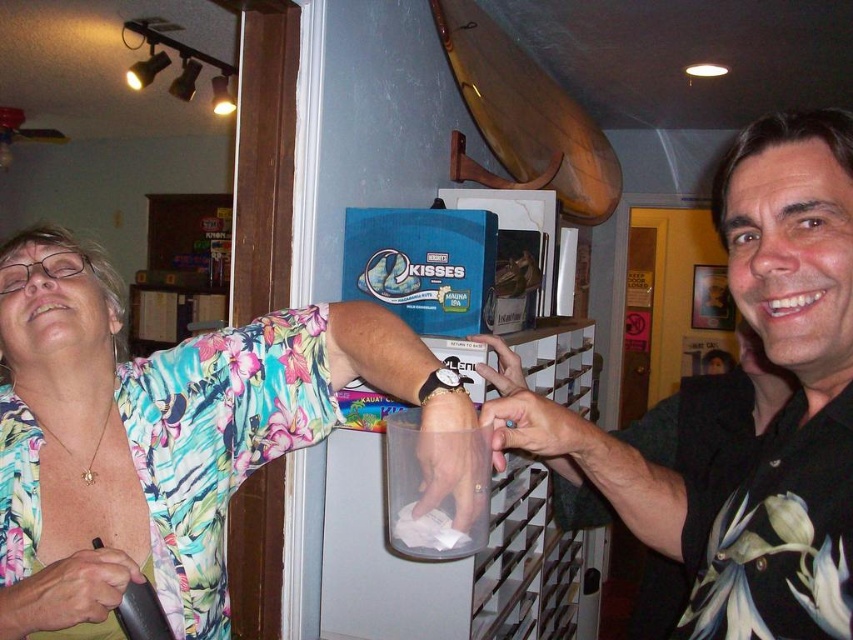
Question: Can you confirm if floral fabric shirt at upper left is positioned to the right of black matte shirt at center?

Choices:
 (A) yes
 (B) no

Answer: (B)

Question: Is the position of floral fabric shirt at upper left less distant than that of black matte shirt at center?

Choices:
 (A) yes
 (B) no

Answer: (B)

Question: Which of the following is the closest to the observer?

Choices:
 (A) black matte shirt at center
 (B) floral fabric shirt at upper left

Answer: (A)

Question: Is floral fabric shirt at upper left to the left of black matte shirt at center from the viewer's perspective?

Choices:
 (A) no
 (B) yes

Answer: (B)